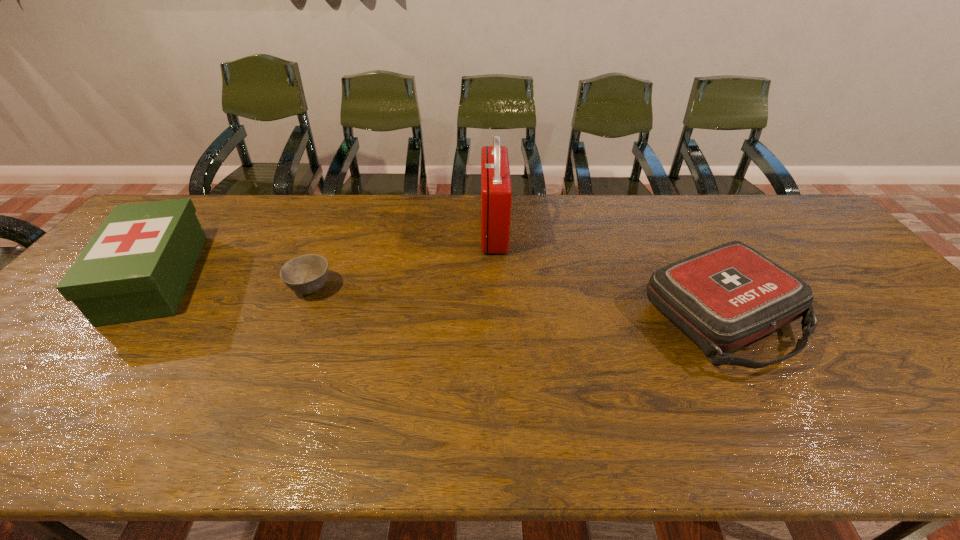
The image size is (960, 540). Identify the location of free space between the third shortest object and the third object from right to left. (233, 282).

Where is `vacant area that lies between the rightmost first-aid kit and the tallest object`? The width and height of the screenshot is (960, 540). vacant area that lies between the rightmost first-aid kit and the tallest object is located at coordinates [x=608, y=272].

Identify the location of empty space between the second object from right to left and the third tallest object. (608, 272).

In order to click on free spot between the rightmost object and the second object from right to left in this screenshot , I will do `click(608, 272)`.

The width and height of the screenshot is (960, 540). Identify the location of empty space that is in between the second tallest object and the shortest first-aid kit. (439, 296).

The width and height of the screenshot is (960, 540). I want to click on vacant space in between the second object from left to right and the tallest object, so click(x=402, y=259).

The width and height of the screenshot is (960, 540). Identify the location of empty space between the bowl and the third tallest object. (516, 302).

Locate an element on the screen. empty location between the rightmost first-aid kit and the tallest object is located at coordinates [608, 272].

At what (x,y) coordinates should I click in order to perform the action: click on free spot between the shortest first-aid kit and the second object from right to left. Please return your answer as a coordinate pair (x, y). Looking at the image, I should click on (608, 272).

Identify the location of the second closest object to the third object from right to left. (496, 193).